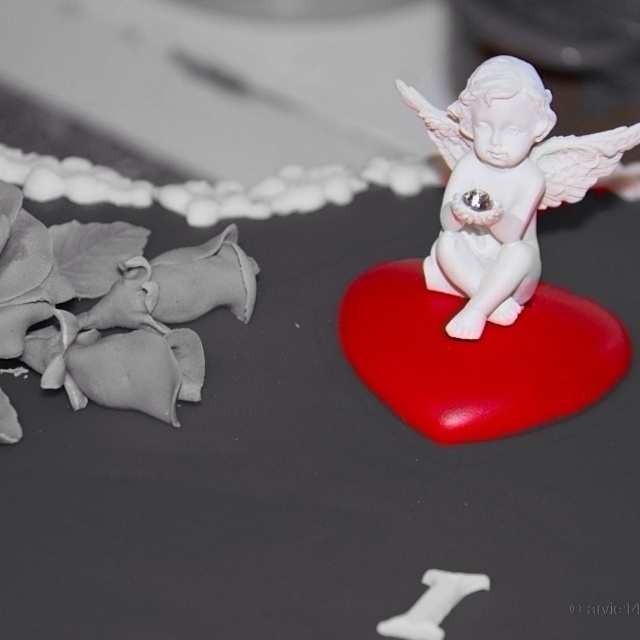
You are observing the image and want to know which of the two points, point (92, 352) or point (451, 253), is nearer to you. Can you determine this based on their positions?

Point (92, 352) is closer to the camera than point (451, 253), so it is nearer to you.

You are an interior designer arranging a display. You have two items to place on a shelf. The matte gray petals at left and the white glossy cherub at center right. If you want to create a balanced composition, which item should you place closer to the edge of the shelf?

The matte gray petals at left should be placed closer to the edge of the shelf because they are larger in size than the white glossy cherub at center right, helping to balance the visual weight.

You are standing in front of the angel figurine and want to take a photo of the matte gray petals at left. If your camera is 1 meter away from the petals, will you be able to capture them clearly in your photo?

The matte gray petals at left and camera are 89.94 centimeters apart from each other, which is less than 1 meter. Therefore, you are too close to capture them clearly in your photo.